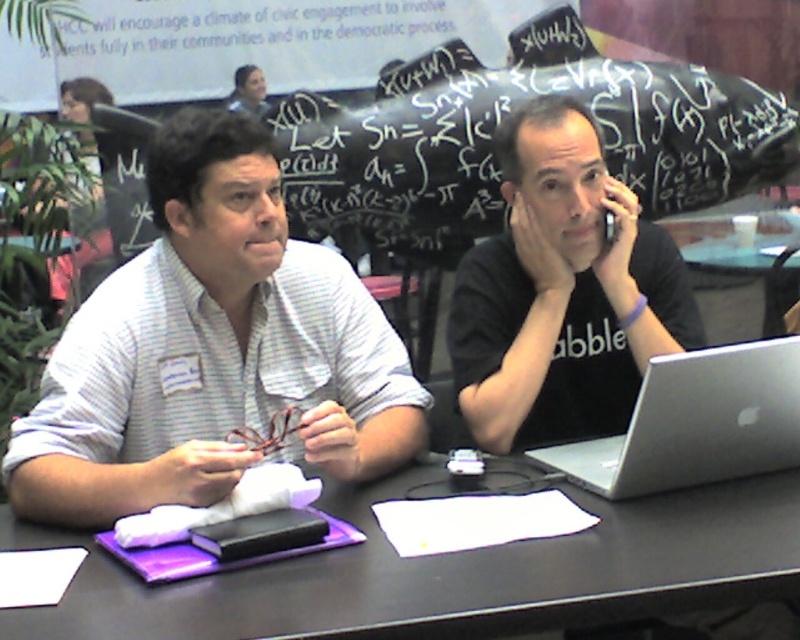
Based on the photo, does black matte table at center appear on the right side of silver metallic laptop at right?

In fact, black matte table at center is to the left of silver metallic laptop at right.

Between black matte table at center and silver metallic laptop at right, which one is positioned higher?

silver metallic laptop at right is above.

Where is `black matte table at center`? The height and width of the screenshot is (640, 800). black matte table at center is located at coordinates (449, 573).

Locate an element on the screen. black matte table at center is located at coordinates (449, 573).

Does point (400, 173) come behind point (262, 92)?

No, (400, 173) is in front of (262, 92).

Measure the distance between black chalkboard at center and matte black shirt at upper center.

They are 30.95 inches apart.

The width and height of the screenshot is (800, 640). What are the coordinates of `black chalkboard at center` in the screenshot? It's located at (494, 154).

Identify the location of black chalkboard at center. (494, 154).

Does silver metallic laptop at right have a lesser height compared to matte black shirt at upper center?

Incorrect, silver metallic laptop at right's height does not fall short of matte black shirt at upper center's.

At what (x,y) coordinates should I click in order to perform the action: click on silver metallic laptop at right. Please return your answer as a coordinate pair (x, y). The image size is (800, 640). Looking at the image, I should click on (696, 422).

Locate an element on the screen. Image resolution: width=800 pixels, height=640 pixels. silver metallic laptop at right is located at coordinates (696, 422).